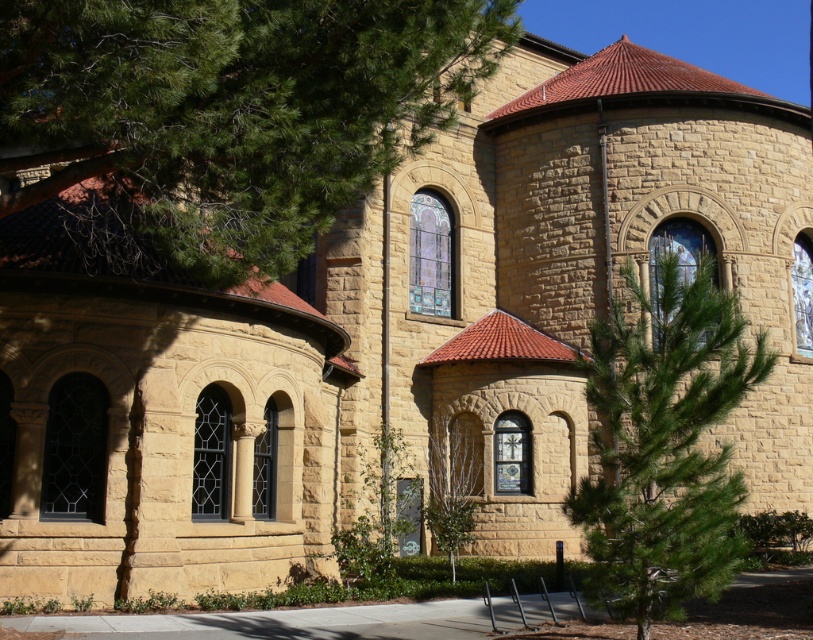
Question: Which point appears farthest from the camera in this image?

Choices:
 (A) (681, 451)
 (B) (438, 548)
 (C) (81, 205)

Answer: (B)

Question: Does green leafy tree at upper left come in front of green needle-like tree at center?

Choices:
 (A) yes
 (B) no

Answer: (A)

Question: Considering the relative positions of green leafy tree at upper left and green needle-like tree at center in the image provided, where is green leafy tree at upper left located with respect to green needle-like tree at center?

Choices:
 (A) above
 (B) below

Answer: (A)

Question: Among these points, which one is nearest to the camera?

Choices:
 (A) (624, 273)
 (B) (133, 205)
 (C) (459, 524)

Answer: (B)

Question: Is green leafy tree at upper left thinner than green leafy tree at center?

Choices:
 (A) no
 (B) yes

Answer: (A)

Question: Which point appears farthest from the camera in this image?

Choices:
 (A) (611, 417)
 (B) (54, 54)
 (C) (442, 424)

Answer: (C)